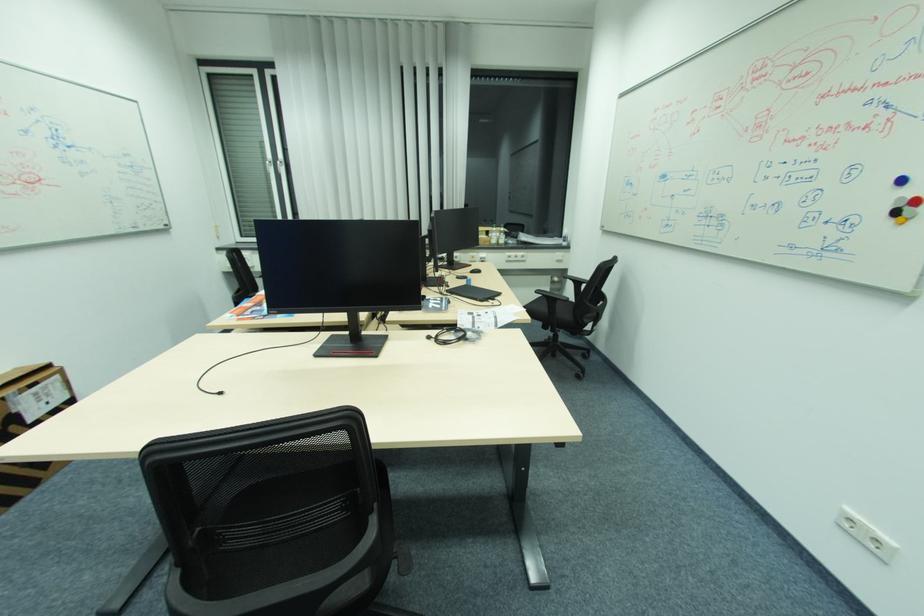
Locate an element on the screen. The height and width of the screenshot is (616, 924). white wall socket is located at coordinates (867, 535).